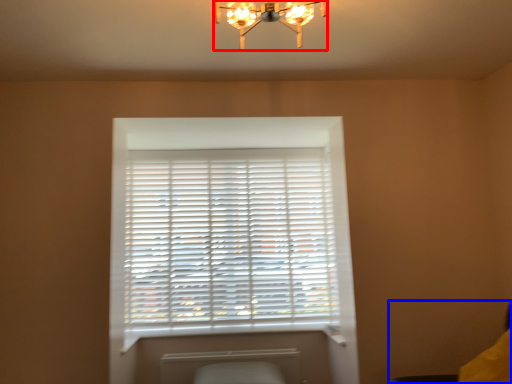
Question: Among these objects, which one is nearest to the camera, lamp (highlighted by a red box) or swivel chair (highlighted by a blue box)?

Choices:
 (A) lamp
 (B) swivel chair

Answer: (A)